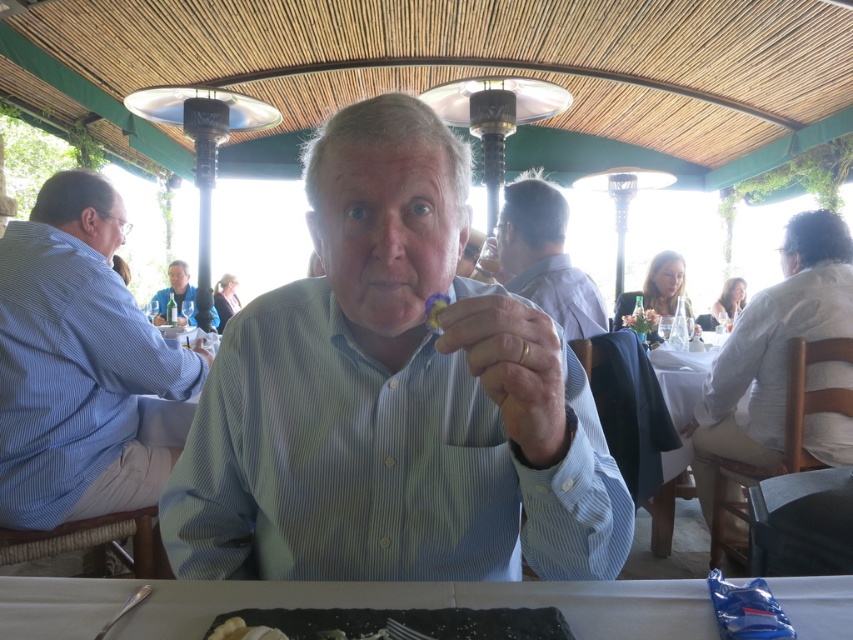
Question: Considering the relative positions of light blue striped shirt at center and matte plastic ring at center in the image provided, where is light blue striped shirt at center located with respect to matte plastic ring at center?

Choices:
 (A) left
 (B) right

Answer: (A)

Question: Does green leafy salad at center appear under yellow rubber ring at center?

Choices:
 (A) no
 (B) yes

Answer: (A)

Question: Which point is closer to the camera taking this photo?

Choices:
 (A) (637, 326)
 (B) (427, 316)

Answer: (B)

Question: Considering the real-world distances, which object is closest to the white glossy table at lower center?

Choices:
 (A) matte blue shirt at center
 (B) yellow rubber ring at center
 (C) black stone plate at lower center
 (D) blue striped shirt at left

Answer: (C)

Question: Is light blue striped shirt at center to the right of black stone plate at lower center from the viewer's perspective?

Choices:
 (A) yes
 (B) no

Answer: (B)

Question: Based on their relative distances, which object is farther from the blue striped shirt at left?

Choices:
 (A) light brown shirt at center
 (B) green leafy salad at center

Answer: (B)